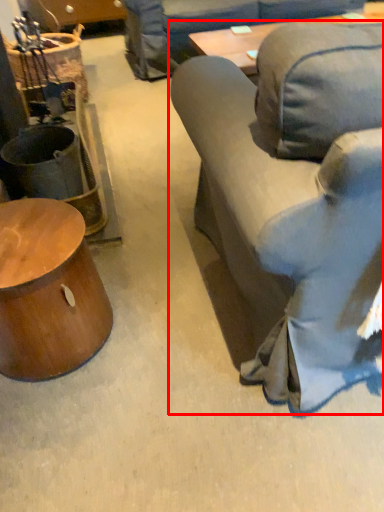
Question: From the image's perspective, where is studio couch (annotated by the red box) located in relation to table in the image?

Choices:
 (A) below
 (B) above

Answer: (B)